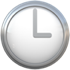
Identify the location of clock emoji. (25, 35).